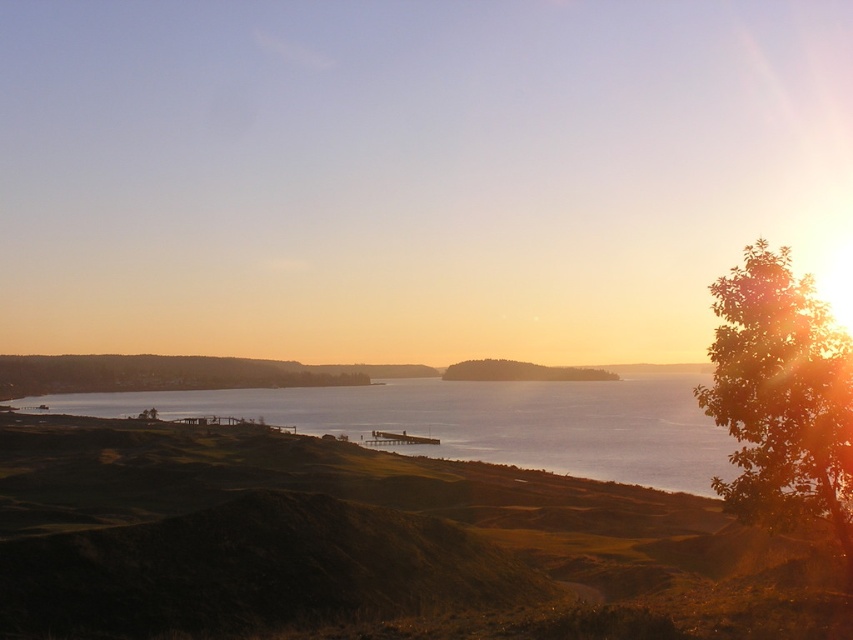
Question: Which object appears farthest from the camera in this image?

Choices:
 (A) green leafy tree at center
 (B) shiny blue water at center

Answer: (A)

Question: Is green grassy hillside at lower left below green leafy tree at center?

Choices:
 (A) no
 (B) yes

Answer: (A)

Question: Which point appears farthest from the camera in this image?

Choices:
 (A) (408, 506)
 (B) (697, 465)
 (C) (756, 368)

Answer: (B)

Question: Where is shiny blue water at center located in relation to green leafy tree at right in the image?

Choices:
 (A) above
 (B) below

Answer: (B)

Question: Considering the real-world distances, which object is closest to the shiny blue water at center?

Choices:
 (A) green leafy tree at right
 (B) green grassy hillside at lower left
 (C) green leafy tree at center

Answer: (C)

Question: Can you confirm if shiny blue water at center is positioned above green leafy tree at center?

Choices:
 (A) no
 (B) yes

Answer: (B)